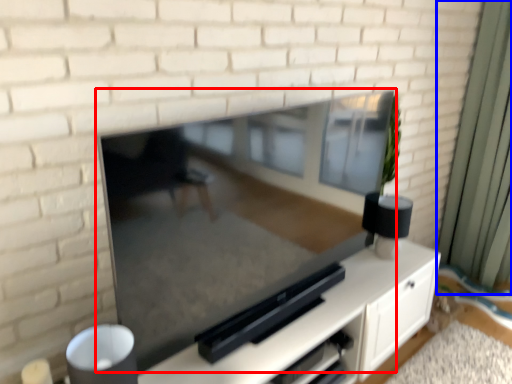
Question: Which object is closer to the camera taking this photo, fireplace (highlighted by a red box) or curtain (highlighted by a blue box)?

Choices:
 (A) fireplace
 (B) curtain

Answer: (A)